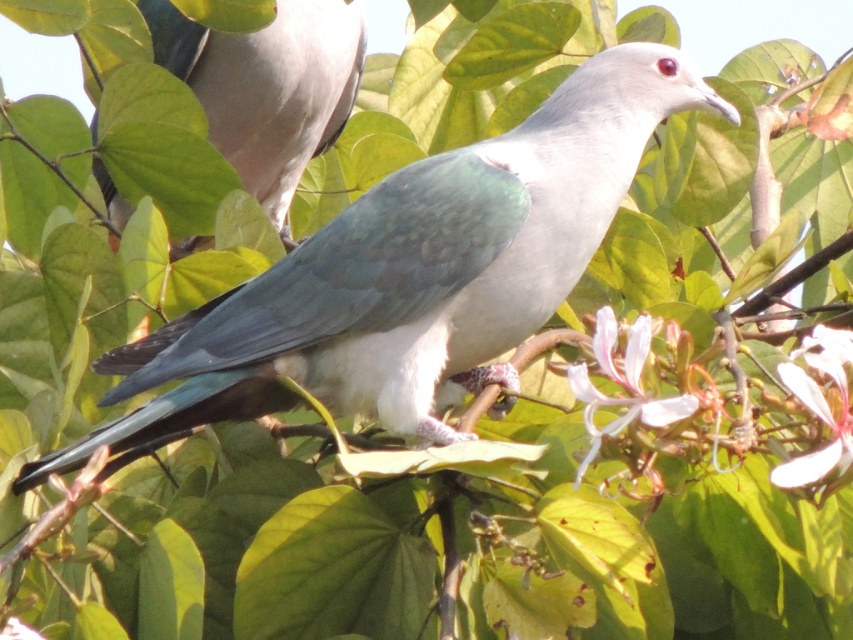
Question: Which of the following is the closest to the observer?

Choices:
 (A) matte green bird at center
 (B) matte gray dove at upper left

Answer: (A)

Question: Which object appears farthest from the camera in this image?

Choices:
 (A) matte gray dove at upper left
 (B) matte green bird at center

Answer: (A)

Question: Considering the relative positions of matte green bird at center and matte gray dove at upper left in the image provided, where is matte green bird at center located with respect to matte gray dove at upper left?

Choices:
 (A) right
 (B) left

Answer: (A)

Question: Does matte green bird at center appear on the right side of matte gray dove at upper left?

Choices:
 (A) yes
 (B) no

Answer: (A)

Question: Observing the image, what is the correct spatial positioning of matte green bird at center in reference to matte gray dove at upper left?

Choices:
 (A) below
 (B) above

Answer: (A)